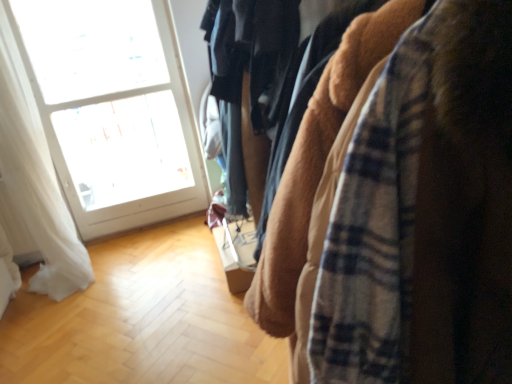
Question: From a real-world perspective, is white glass window at upper left below plaid flannel shirt at right?

Choices:
 (A) no
 (B) yes

Answer: (A)

Question: Is white glass window at upper left positioned before plaid flannel shirt at right?

Choices:
 (A) yes
 (B) no

Answer: (B)

Question: Are white glass window at upper left and plaid flannel shirt at right making contact?

Choices:
 (A) yes
 (B) no

Answer: (B)

Question: Is white glass window at upper left looking in the opposite direction of plaid flannel shirt at right?

Choices:
 (A) yes
 (B) no

Answer: (B)

Question: Would you say white glass window at upper left is outside plaid flannel shirt at right?

Choices:
 (A) no
 (B) yes

Answer: (B)

Question: Based on their positions, is white glass window at upper left located to the left or right of plaid flannel shirt at right?

Choices:
 (A) right
 (B) left

Answer: (B)

Question: Is point (117, 62) closer or farther from the camera than point (424, 117)?

Choices:
 (A) farther
 (B) closer

Answer: (A)

Question: Looking at their shapes, would you say white glass window at upper left is wider or thinner than plaid flannel shirt at right?

Choices:
 (A) wide
 (B) thin

Answer: (B)

Question: Which is correct: white glass window at upper left is inside plaid flannel shirt at right, or outside of it?

Choices:
 (A) inside
 (B) outside

Answer: (B)

Question: Considering the positions of plaid flannel shirt at right and white sheer curtain at left in the image, is plaid flannel shirt at right taller or shorter than white sheer curtain at left?

Choices:
 (A) tall
 (B) short

Answer: (B)

Question: From a real-world perspective, is plaid flannel shirt at right positioned above or below white sheer curtain at left?

Choices:
 (A) below
 (B) above

Answer: (A)

Question: Is plaid flannel shirt at right spatially inside white sheer curtain at left, or outside of it?

Choices:
 (A) inside
 (B) outside

Answer: (B)

Question: From the image's perspective, is plaid flannel shirt at right positioned above or below white sheer curtain at left?

Choices:
 (A) above
 (B) below

Answer: (B)

Question: From the image's perspective, is white sheer curtain at left above or below plaid flannel shirt at right?

Choices:
 (A) above
 (B) below

Answer: (A)

Question: From a real-world perspective, relative to plaid flannel shirt at right, is white sheer curtain at left vertically above or below?

Choices:
 (A) below
 (B) above

Answer: (B)